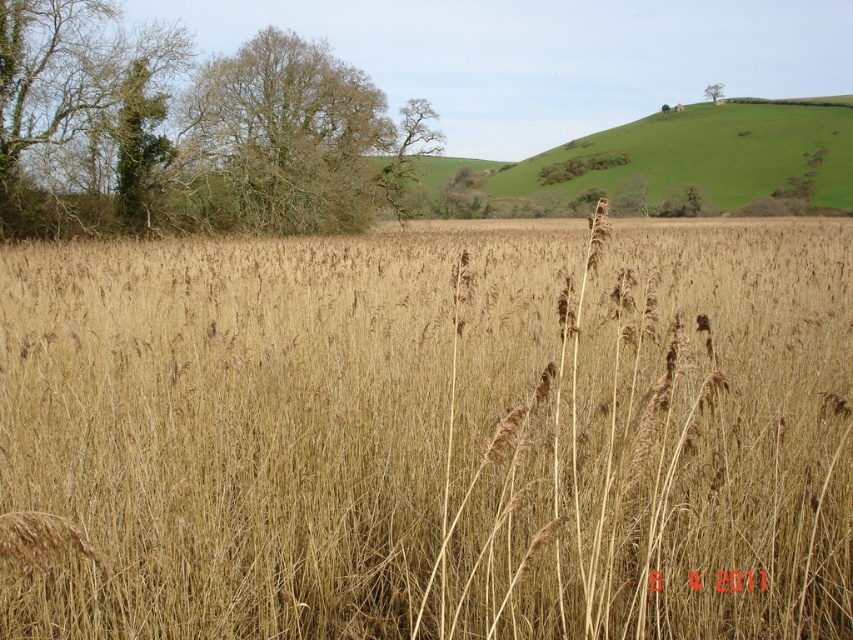
You are standing in the field and notice two green leafy trees in the distance. Which tree, the green leafy tree at upper left or the green leafy tree at upper right, appears closer to you?

The green leafy tree at upper left appears closer because it is in front of the green leafy tree at upper right.

You are standing in the field and want to find the tallest tree to climb. Which tree should you choose between the green leafy tree at upper left and the green leafy tree at upper right?

The green leafy tree at upper left is taller than the green leafy tree at upper right, so you should choose the green leafy tree at upper left to climb.

You are standing in the field and see the green leafy tree at upper left and the green leafy tree at center. Which tree is closer to the horizon?

The green leafy tree at upper left is below the green leafy tree at center, so the green leafy tree at center is closer to the horizon.